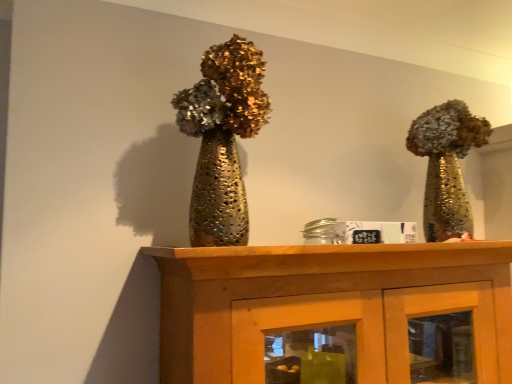
The width and height of the screenshot is (512, 384). I want to click on gold sequined floral arrangement at center, so click(222, 138).

Describe the element at coordinates (222, 138) in the screenshot. The height and width of the screenshot is (384, 512). I see `gold sequined floral arrangement at center` at that location.

Identify the location of gold sequined floral arrangement at center. (222, 138).